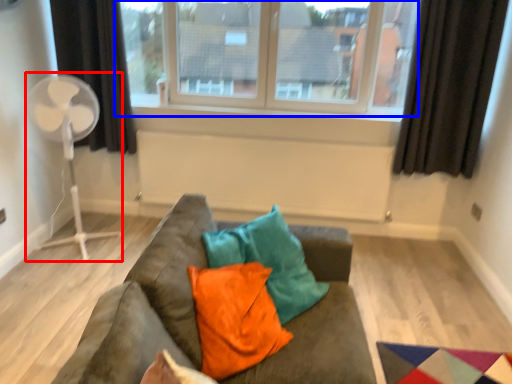
Question: Which object appears closest to the camera in this image, fan (highlighted by a red box) or window (highlighted by a blue box)?

Choices:
 (A) fan
 (B) window

Answer: (A)